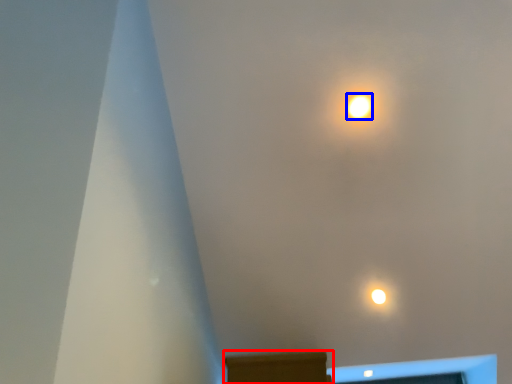
Question: Among these objects, which one is farthest to the camera, furniture (highlighted by a red box) or lamp (highlighted by a blue box)?

Choices:
 (A) furniture
 (B) lamp

Answer: (B)